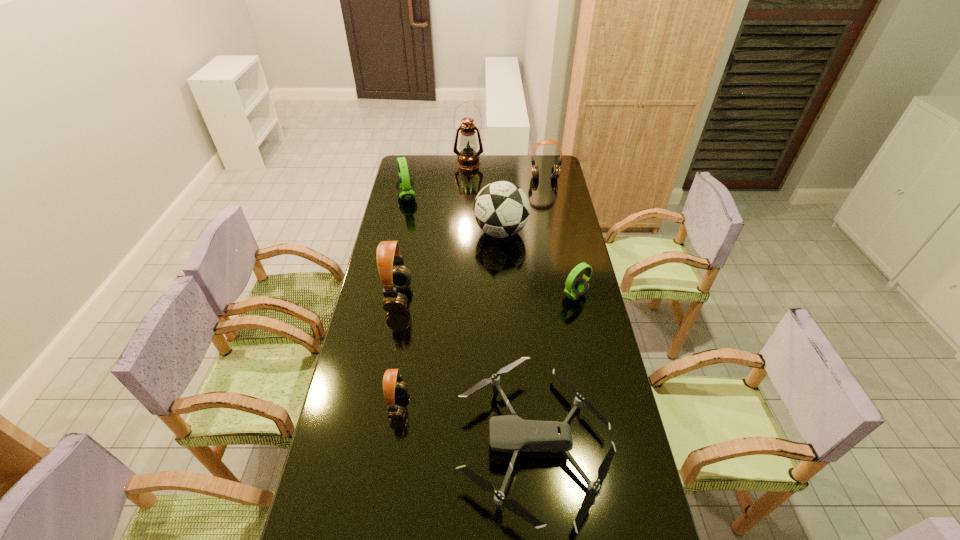
You are a GUI agent. You are given a task and a screenshot of the screen. Output one action in this format:
    pyautogui.click(x=<x>, y=<y>)
    Task: Click on the vacant space that satisfies the following two spatial constraints: 1. on the surface of the black soccer ball where the brand logo is visible; 2. on the left side of the smaller green headset
    Image resolution: width=960 pixels, height=540 pixels.
    Given the screenshot: What is the action you would take?
    pyautogui.click(x=504, y=295)

This screenshot has height=540, width=960. What are the coordinates of `vacant area in the image that satisfies the following two spatial constraints: 1. on the ear cups of the nearer green headset; 2. on the right side of the second farthest object` in the screenshot? It's located at (567, 295).